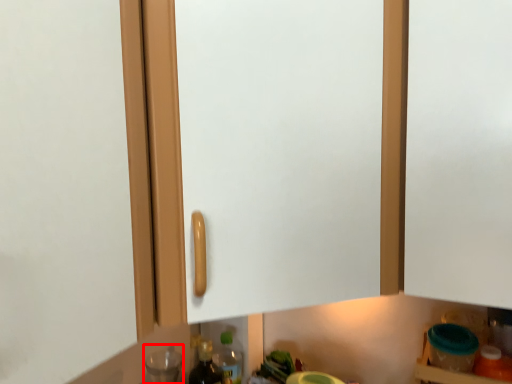
Question: Where is bottle (annotated by the red box) located in relation to bottle in the image?

Choices:
 (A) right
 (B) left

Answer: (B)